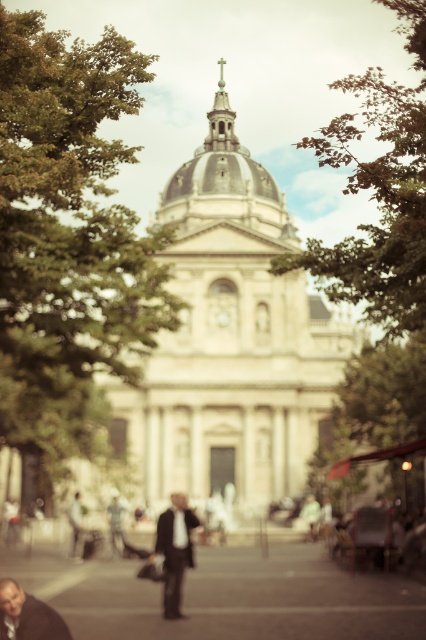
You are a photographer who wants to capture a clear shot of the dark gray suit at center without the matte brown jacket at lower left blocking it. What adjustment should you make to your camera?

The matte brown jacket at lower left is behind the dark gray suit at center, so to avoid it blocking the view, you should focus on the dark gray suit at center and ensure the matte brown jacket at lower left remains in the background by maintaining the current depth of field or adjusting the aperture to keep the background blurred.